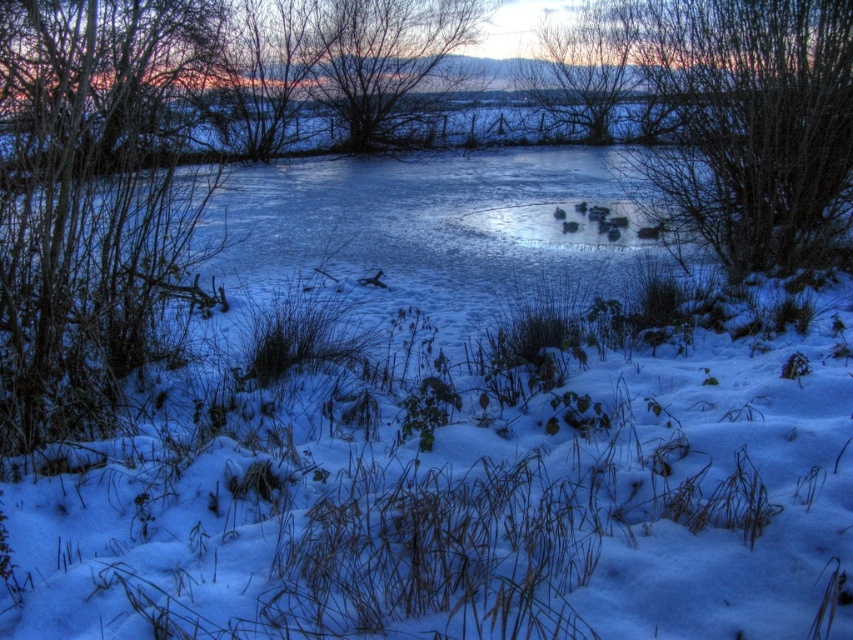
Question: Considering the real-world distances, which object is closest to the smooth bark tree at left?

Choices:
 (A) bare branches at upper right
 (B) bare branches at upper center

Answer: (B)

Question: Is smooth bark tree at left positioned at the back of bare branches at upper right?

Choices:
 (A) no
 (B) yes

Answer: (A)

Question: Which point is closer to the camera?

Choices:
 (A) bare branches at upper right
 (B) bare branches at upper center

Answer: (A)

Question: Is smooth bark tree at left above bare branches at upper center?

Choices:
 (A) no
 (B) yes

Answer: (A)

Question: Considering the relative positions of smooth bark tree at left and bare branches at upper center in the image provided, where is smooth bark tree at left located with respect to bare branches at upper center?

Choices:
 (A) above
 (B) below

Answer: (B)

Question: Which object is farther from the camera taking this photo?

Choices:
 (A) smooth bark tree at left
 (B) bare branches at upper right

Answer: (B)